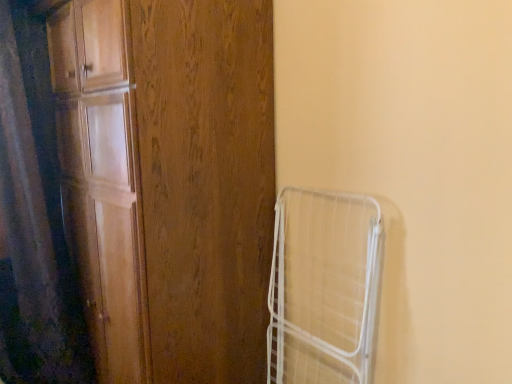
Question: Could you tell me if wooden door at left is facing white wire cage at right?

Choices:
 (A) no
 (B) yes

Answer: (A)

Question: From a real-world perspective, is wooden door at left over white wire cage at right?

Choices:
 (A) no
 (B) yes

Answer: (B)

Question: Can you confirm if wooden door at left is smaller than white wire cage at right?

Choices:
 (A) yes
 (B) no

Answer: (B)

Question: Can you confirm if wooden door at left is bigger than white wire cage at right?

Choices:
 (A) no
 (B) yes

Answer: (B)

Question: From the image's perspective, is wooden door at left beneath white wire cage at right?

Choices:
 (A) no
 (B) yes

Answer: (A)

Question: From a real-world perspective, does wooden door at left sit lower than white wire cage at right?

Choices:
 (A) no
 (B) yes

Answer: (A)

Question: Is white wire cage at right facing towards wooden door at left?

Choices:
 (A) yes
 (B) no

Answer: (B)

Question: Is white wire cage at right further to the viewer compared to wooden door at left?

Choices:
 (A) no
 (B) yes

Answer: (B)

Question: Is white wire cage at right shorter than wooden door at left?

Choices:
 (A) yes
 (B) no

Answer: (A)

Question: Considering the relative sizes of white wire cage at right and wooden door at left in the image provided, is white wire cage at right bigger than wooden door at left?

Choices:
 (A) no
 (B) yes

Answer: (A)

Question: From a real-world perspective, is white wire cage at right on top of wooden door at left?

Choices:
 (A) no
 (B) yes

Answer: (A)

Question: Considering the relative sizes of white wire cage at right and wooden door at left in the image provided, is white wire cage at right taller than wooden door at left?

Choices:
 (A) no
 (B) yes

Answer: (A)

Question: Can you confirm if black matte shower curtain at left is positioned to the left of white wire cage at right?

Choices:
 (A) no
 (B) yes

Answer: (B)